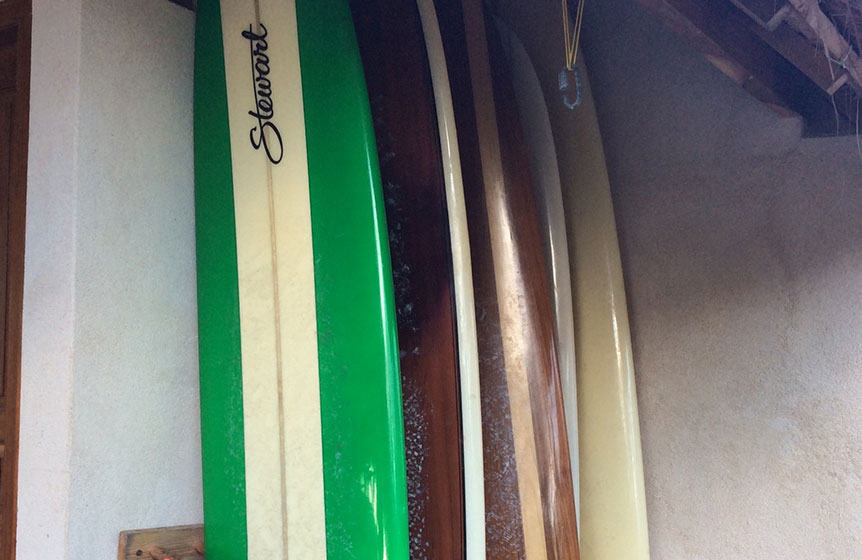
This screenshot has height=560, width=862. In order to click on frame in this screenshot , I will do `click(16, 499)`.